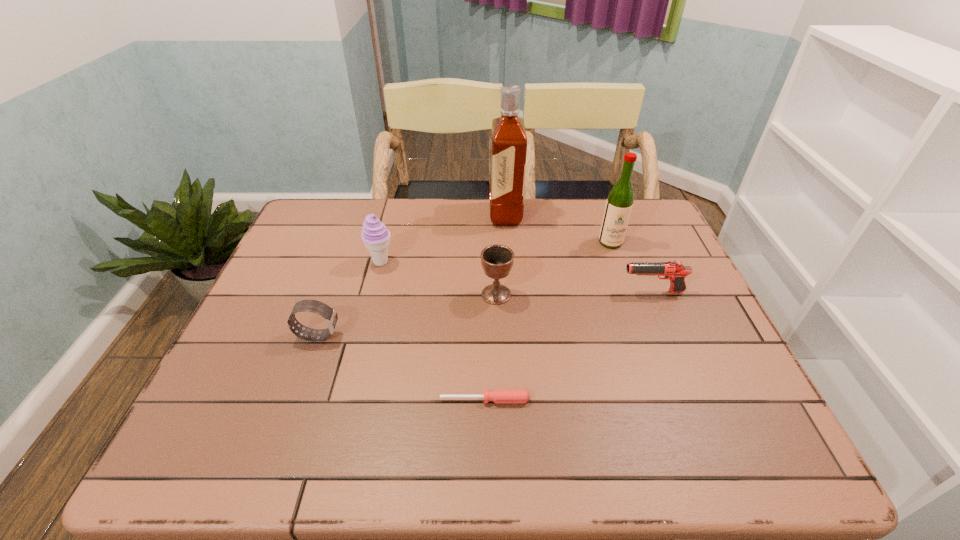
The height and width of the screenshot is (540, 960). Find the location of `vacant space situated at the aiming end of the gun`. vacant space situated at the aiming end of the gun is located at coordinates (557, 292).

Where is `free space located 0.170m at the aiming end of the gun`? This screenshot has height=540, width=960. free space located 0.170m at the aiming end of the gun is located at coordinates (557, 292).

The width and height of the screenshot is (960, 540). In order to click on vacant space situated on the front of the nearest object in this screenshot , I will do `click(485, 437)`.

Find the location of a particular element. object positioned at the left edge is located at coordinates (314, 306).

Where is `liquor that is at the right edge`? This screenshot has height=540, width=960. liquor that is at the right edge is located at coordinates (619, 203).

The height and width of the screenshot is (540, 960). I want to click on gun that is at the right edge, so click(x=674, y=270).

Find the location of a particular element. The image size is (960, 540). object present at the far right corner is located at coordinates (619, 203).

Locate an element on the screen. The image size is (960, 540). vacant region at the far edge of the desktop is located at coordinates [x=363, y=219].

What are the coordinates of `vacant space at the near edge of the desktop` in the screenshot? It's located at (371, 449).

Find the location of a particular element. The width and height of the screenshot is (960, 540). vacant space at the left edge of the desktop is located at coordinates (292, 355).